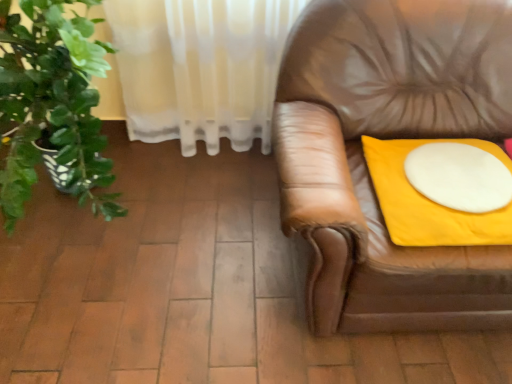
Find the location of a particular element. Image resolution: width=512 pixels, height=384 pixels. vacant space underneath white matte round table at right (from a real-world perspective) is located at coordinates (461, 176).